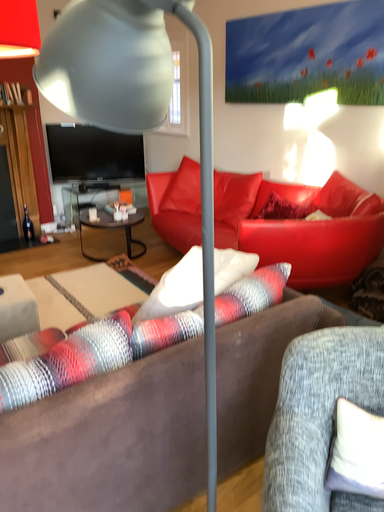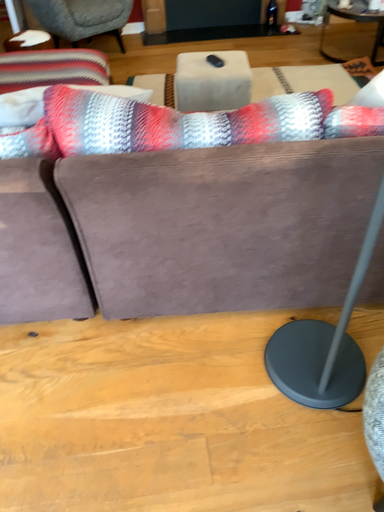
Question: Which way did the camera rotate in the video?

Choices:
 (A) rotated upward
 (B) rotated downward

Answer: (B)